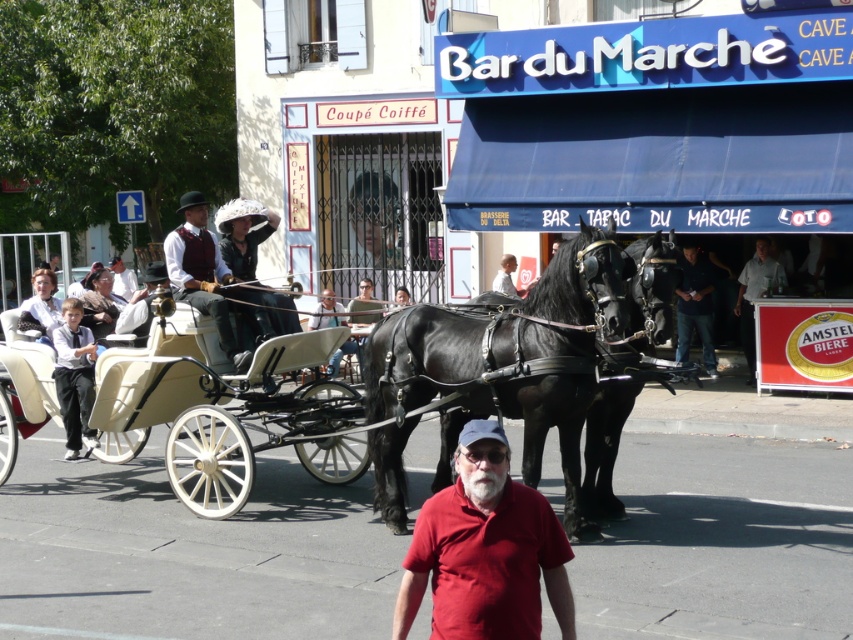
You are a photographer standing on the street and want to take a picture of the dark blue jeans at center and the smooth leather jacket at center. Which one will appear larger in the photo?

The dark blue jeans at center will appear larger in the photo because it is much taller than the smooth leather jacket at center.

You are standing at the point marked by the coordinates point (202,273) in the image. What object is located exactly at this point?

The point (202,273) marks the location of the matte brown vest at center.